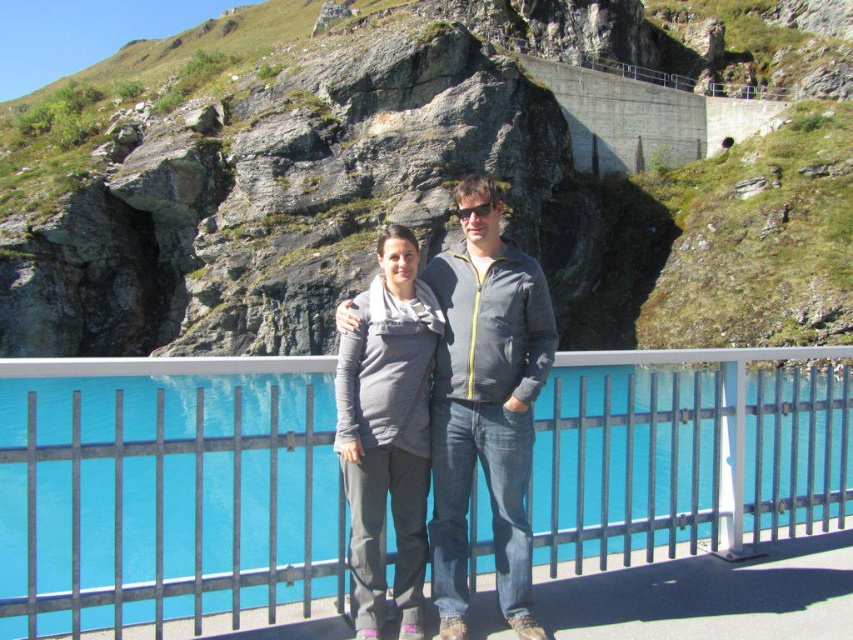
Question: Does blue glass pool at center have a larger size compared to matte gray sweater at center?

Choices:
 (A) yes
 (B) no

Answer: (A)

Question: Which of these objects is positioned closest to the blue glass pool at center?

Choices:
 (A) gray fabric sweater at center
 (B) matte gray sweater at center

Answer: (A)

Question: In this image, where is rough stone hillside at upper center located relative to blue glass pool at center?

Choices:
 (A) left
 (B) right

Answer: (B)

Question: Does blue glass pool at center have a greater width compared to gray fabric sweater at center?

Choices:
 (A) no
 (B) yes

Answer: (B)

Question: Which point is farther to the camera?

Choices:
 (A) (119, 380)
 (B) (311, 28)

Answer: (B)

Question: Considering the real-world distances, which object is farthest from the matte gray sweater at center?

Choices:
 (A) rough stone hillside at upper center
 (B) gray fabric sweater at center
 (C) blue glass pool at center

Answer: (A)